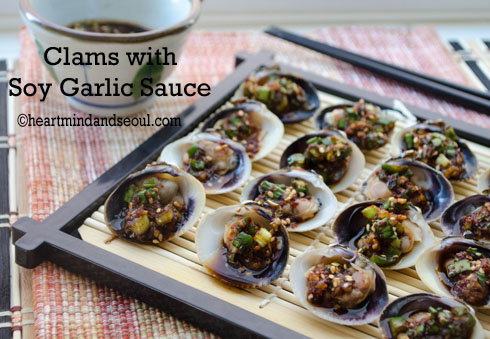
Locate an element on the screen. bamboo mat is located at coordinates (45, 151).